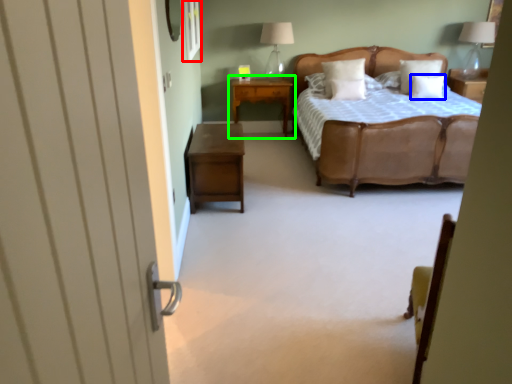
Question: Estimate the real-world distances between objects in this image. Which object is closer to window (highlighted by a red box), pillow (highlighted by a blue box) or nightstand (highlighted by a green box)?

Choices:
 (A) pillow
 (B) nightstand

Answer: (B)